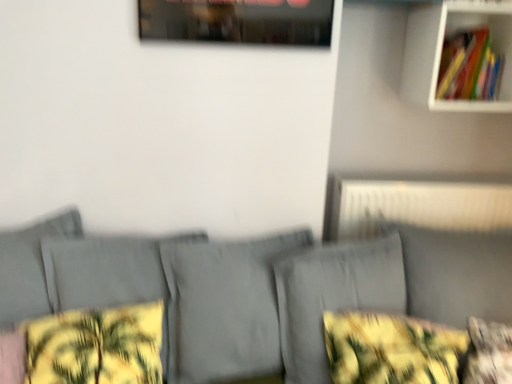
Question: From the image's perspective, relative to white textured radiator at upper right, is white matte shelf at upper right above or below?

Choices:
 (A) above
 (B) below

Answer: (A)

Question: From a real-world perspective, relative to white textured radiator at upper right, is white matte shelf at upper right vertically above or below?

Choices:
 (A) above
 (B) below

Answer: (A)

Question: Which object is the closest to the yellow floral fabric at lower right?

Choices:
 (A) yellow floral fabric pillow at lower right, acting as the first pillow starting from the right
 (B) hardcover books at upper right
 (C) gray fabric couch at center
 (D) yellow floral fabric pillow at lower left, marked as the second pillow in a right-to-left arrangement
 (E) white matte shelf at upper right

Answer: (A)

Question: Which is nearer to the white textured radiator at upper right?

Choices:
 (A) white matte shelf at upper right
 (B) yellow floral fabric pillow at lower left, marked as the second pillow in a right-to-left arrangement
 (C) yellow floral fabric pillow at lower right, acting as the first pillow starting from the right
 (D) gray fabric couch at center
 (E) yellow floral fabric at lower right

Answer: (D)